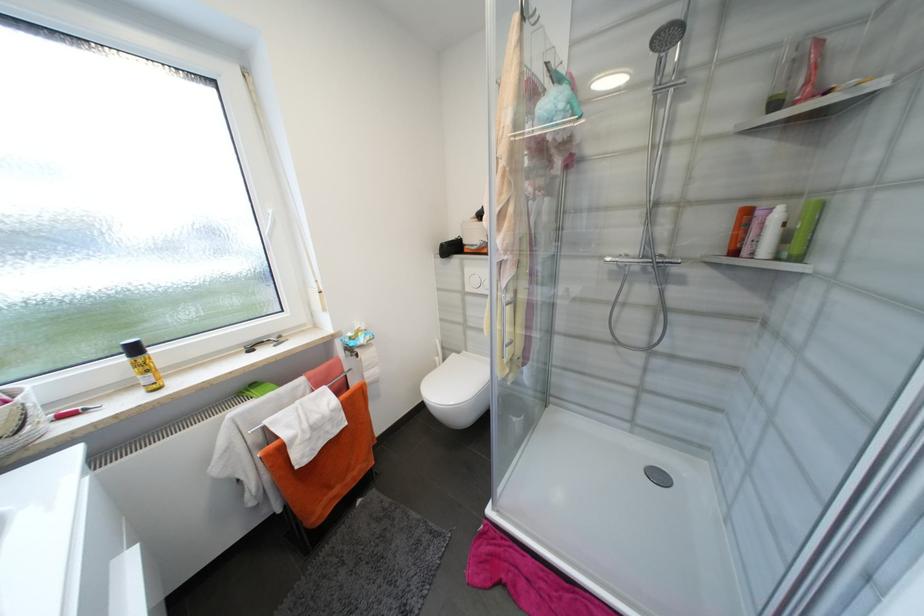
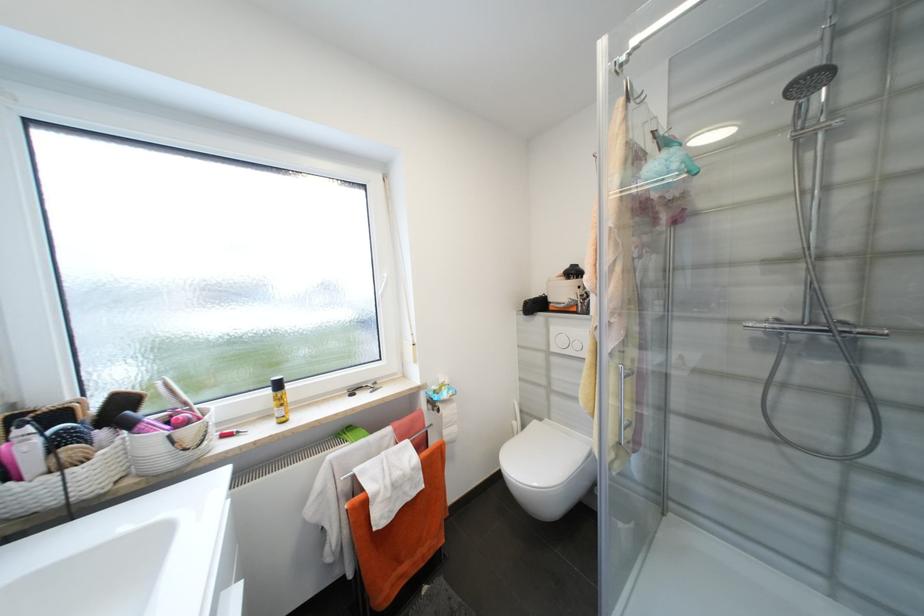
Question: How did the camera likely rotate?

Choices:
 (A) Left
 (B) Right
 (C) Up
 (D) Down

Answer: (A)